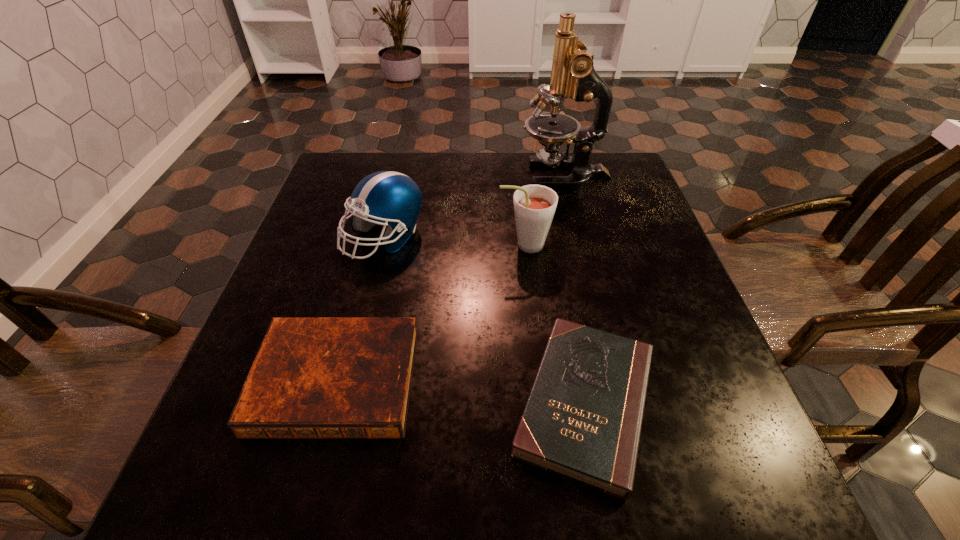
I want to click on blank space that satisfies the following two spatial constraints: 1. at the front of the right Bible with the faceguard; 2. on the left side of the football helmet, so click(345, 403).

Locate an element on the screen. vacant area in the image that satisfies the following two spatial constraints: 1. at the front of the right Bible with the faceguard; 2. on the left side of the football helmet is located at coordinates (345, 403).

Where is `free space that satisfies the following two spatial constraints: 1. on the spine side of the right Bible; 2. on the right side of the left Bible`? This screenshot has width=960, height=540. free space that satisfies the following two spatial constraints: 1. on the spine side of the right Bible; 2. on the right side of the left Bible is located at coordinates (330, 403).

This screenshot has width=960, height=540. What are the coordinates of `free space that satisfies the following two spatial constraints: 1. on the spine side of the left Bible; 2. on the right side of the right Bible` in the screenshot? It's located at (330, 403).

Where is `vacant space that satisfies the following two spatial constraints: 1. on the drink side of the root beer; 2. on the spine side of the left Bible`? vacant space that satisfies the following two spatial constraints: 1. on the drink side of the root beer; 2. on the spine side of the left Bible is located at coordinates (539, 381).